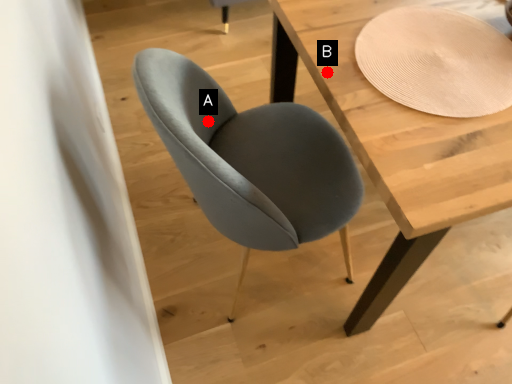
Question: Two points are circled on the image, labeled by A and B beside each circle. Which point is farther to the camera?

Choices:
 (A) A is further
 (B) B is further

Answer: (A)